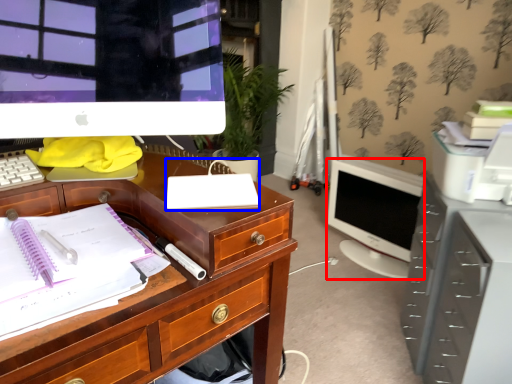
Question: Which object is closer to the camera taking this photo, computer monitor (highlighted by a red box) or office supplies (highlighted by a blue box)?

Choices:
 (A) computer monitor
 (B) office supplies

Answer: (B)